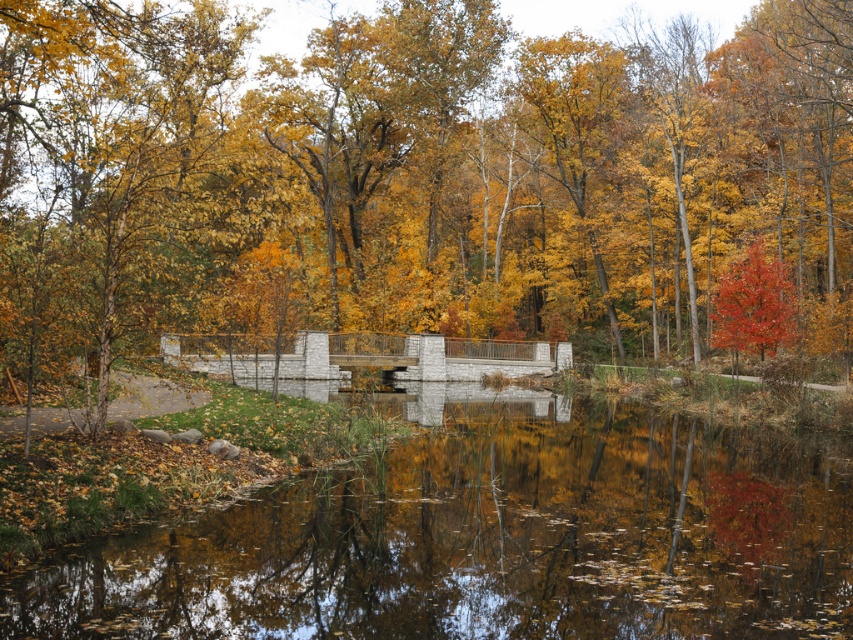
Does golden yellow leaves at center have a lesser height compared to smooth concrete lake at center?

In fact, golden yellow leaves at center may be taller than smooth concrete lake at center.

Describe the element at coordinates (413, 176) in the screenshot. I see `golden yellow leaves at center` at that location.

The width and height of the screenshot is (853, 640). Find the location of `golden yellow leaves at center`. golden yellow leaves at center is located at coordinates (413, 176).

Is golden yellow leaves at center bigger than shiny red tree at right?

Yes, golden yellow leaves at center is bigger than shiny red tree at right.

Is golden yellow leaves at center above shiny red tree at right?

Correct, golden yellow leaves at center is located above shiny red tree at right.

Describe the element at coordinates (413, 176) in the screenshot. I see `golden yellow leaves at center` at that location.

The height and width of the screenshot is (640, 853). Identify the location of golden yellow leaves at center. (413, 176).

Is smooth concrete lake at center further to camera compared to shiny red tree at right?

That is False.

Where is `smooth concrete lake at center`? The width and height of the screenshot is (853, 640). smooth concrete lake at center is located at coordinates (492, 540).

Where is `smooth concrete lake at center`? This screenshot has height=640, width=853. smooth concrete lake at center is located at coordinates (492, 540).